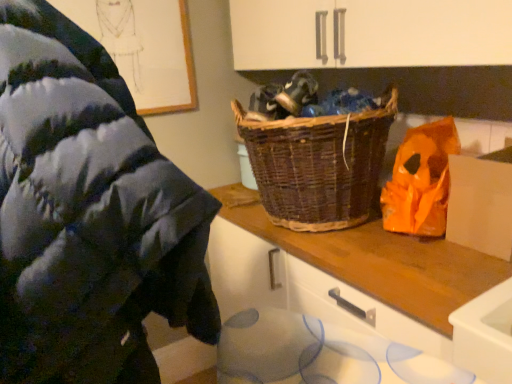
Question: In terms of size, does woven brown picnic basket at center appear bigger or smaller than woolen sweater at upper left?

Choices:
 (A) small
 (B) big

Answer: (A)

Question: Considering the positions of point (281, 200) and point (74, 44), is point (281, 200) closer or farther from the camera than point (74, 44)?

Choices:
 (A) farther
 (B) closer

Answer: (A)

Question: Which object is positioned closest to the orange plastic bag at right?

Choices:
 (A) white cardboard at right
 (B) woolen sweater at upper left
 (C) woven brown picnic basket at center

Answer: (A)

Question: Which object is positioned closest to the woolen sweater at upper left?

Choices:
 (A) woven brown picnic basket at center
 (B) orange plastic bag at right
 (C) white cardboard at right

Answer: (A)